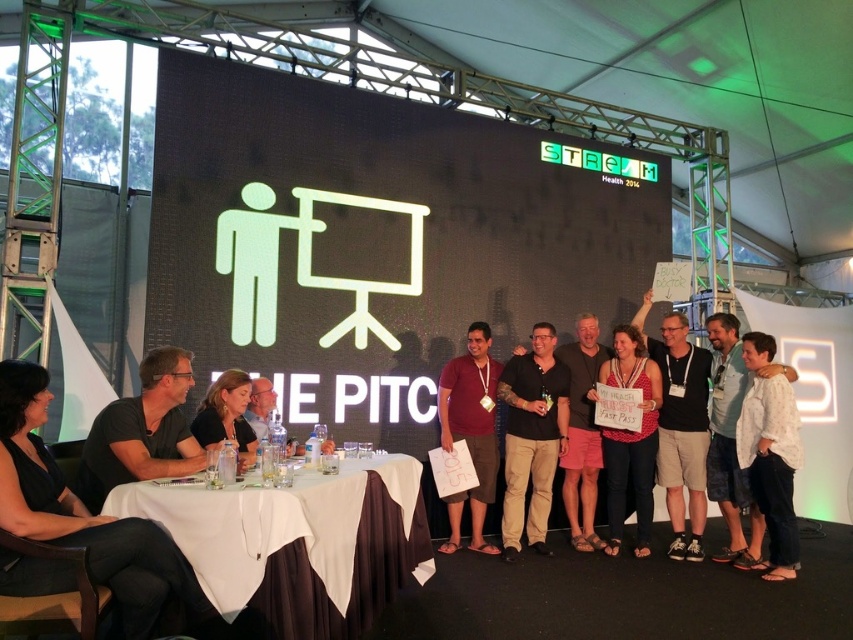
Question: Is white cloth-covered table at lower left thinner than white cotton shirt at center?

Choices:
 (A) no
 (B) yes

Answer: (A)

Question: Which object is the closest to the beige cotton shorts at center?

Choices:
 (A) matte black shirt at upper left
 (B) white cotton shirt at center
 (C) denim shorts at center

Answer: (C)

Question: Can you confirm if black cotton shirt at center is positioned above matte black shirt at upper left?

Choices:
 (A) no
 (B) yes

Answer: (A)

Question: Which object is closer to the camera taking this photo?

Choices:
 (A) black fabric chair at lower left
 (B) matte black shirt at center
 (C) maroon fabric shirt at center
 (D) white cloth-covered table at lower left

Answer: (A)

Question: Does matte black t-shirt at center lie in front of matte black shirt at upper left?

Choices:
 (A) yes
 (B) no

Answer: (B)

Question: Which object is the closest to the beige cotton shorts at center?

Choices:
 (A) matte black t-shirt at center
 (B) white cloth-covered table at lower left
 (C) matte black shirt at left

Answer: (A)